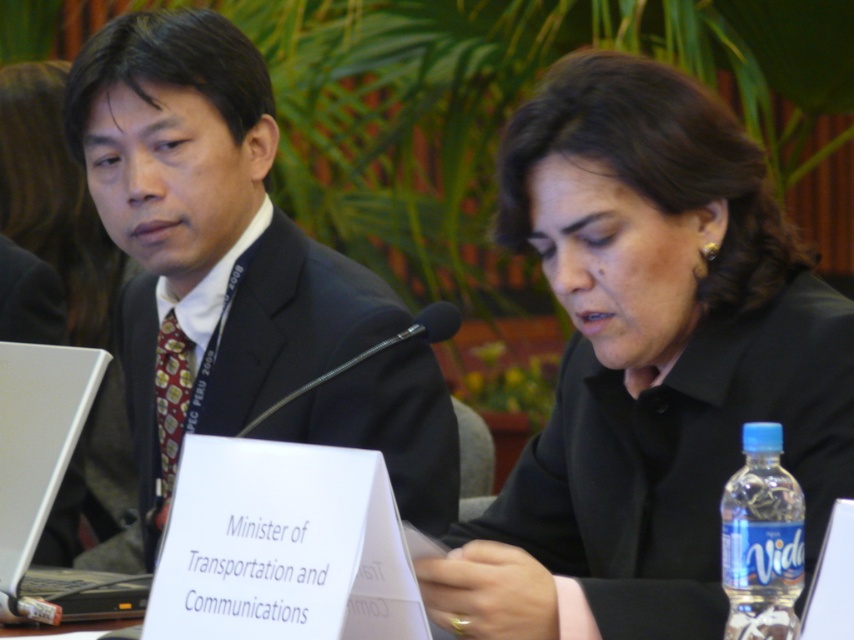
Question: Can you confirm if dark suit at center is wider than silver metallic laptop at left?

Choices:
 (A) yes
 (B) no

Answer: (A)

Question: Does black matte shirt at center lie in front of blue plastic water bottle at lower right?

Choices:
 (A) yes
 (B) no

Answer: (B)

Question: Which object is positioned farthest from the silver metallic laptop at left?

Choices:
 (A) black matte shirt at center
 (B) blue plastic water bottle at lower right

Answer: (B)

Question: Among these objects, which one is farthest from the camera?

Choices:
 (A) dark suit at center
 (B) blue plastic water bottle at lower right

Answer: (A)

Question: Observing the image, what is the correct spatial positioning of black matte shirt at center in reference to blue plastic water bottle at lower right?

Choices:
 (A) below
 (B) above

Answer: (B)

Question: Among these objects, which one is farthest from the camera?

Choices:
 (A) silver metallic laptop at left
 (B) dark suit at center

Answer: (B)